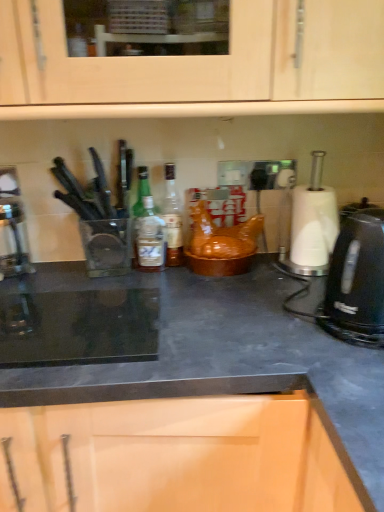
Question: From the image's perspective, relative to black plastic kettle at right, is black matte countertop at center above or below?

Choices:
 (A) below
 (B) above

Answer: (A)

Question: Visually, is black matte countertop at center positioned to the left or to the right of black plastic kettle at right?

Choices:
 (A) right
 (B) left

Answer: (B)

Question: Estimate the real-world distances between objects in this image. Which object is farther from the black plastic kettle at right?

Choices:
 (A) black matte countertop at center
 (B) green glass bottle at center
 (C) translucent glass bottle at center
 (D) metallic silver coffee machine at left

Answer: (D)

Question: Based on their relative distances, which object is farther from the translucent glass bottle at center?

Choices:
 (A) green glass bottle at center
 (B) metallic silver coffee machine at left
 (C) black matte countertop at center
 (D) black plastic kettle at right

Answer: (D)